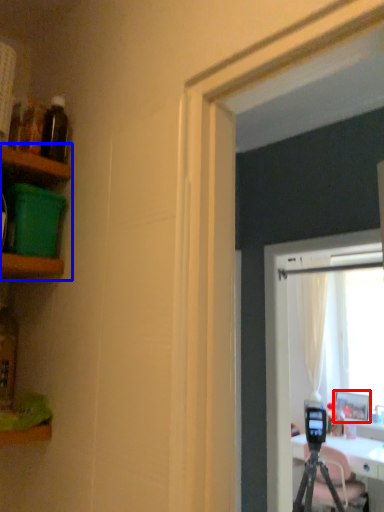
Question: Among these objects, which one is nearest to the camera, picture frame (highlighted by a red box) or shelf (highlighted by a blue box)?

Choices:
 (A) picture frame
 (B) shelf

Answer: (B)